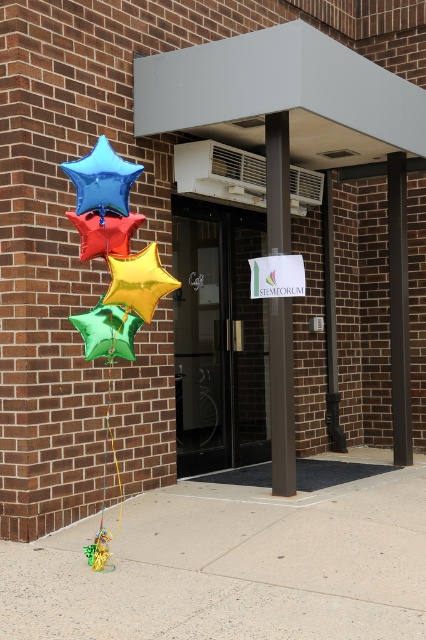
Question: Estimate the real-world distances between objects in this image. Which object is farther from the smooth concrete pavement at center?

Choices:
 (A) brown polished pillar at center
 (B) transparent glass door at center
 (C) green metallic star at lower left
 (D) yellow metallic string at left

Answer: (B)

Question: Which point is closer to the camera taking this photo?

Choices:
 (A) (89, 314)
 (B) (279, 449)
 (C) (351, 532)

Answer: (A)

Question: Observing the image, what is the correct spatial positioning of gold metallic star at center in reference to shiny red star at left?

Choices:
 (A) above
 (B) below

Answer: (B)

Question: Which object appears closest to the camera in this image?

Choices:
 (A) black metal/texture pillar at right
 (B) smooth concrete pavement at center
 (C) yellow metallic string at left

Answer: (B)

Question: Is blue metallic star at left closer to the viewer compared to yellow metallic string at left?

Choices:
 (A) yes
 (B) no

Answer: (A)

Question: From the image, what is the correct spatial relationship of blue metallic star at left in relation to gold metallic star at center?

Choices:
 (A) right
 (B) left

Answer: (B)